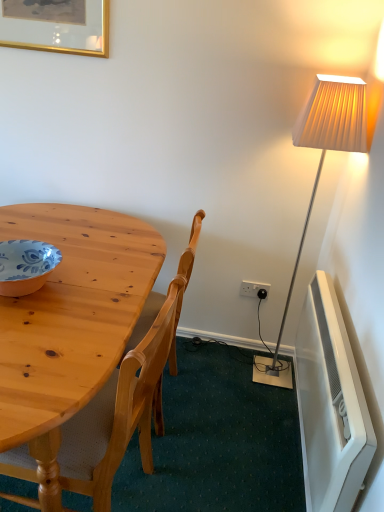
Question: Can you confirm if gold-framed picture at upper left is shorter than natural wood chair at left?

Choices:
 (A) yes
 (B) no

Answer: (A)

Question: Considering the relative positions of gold-framed picture at upper left and natural wood chair at left in the image provided, is gold-framed picture at upper left behind natural wood chair at left?

Choices:
 (A) no
 (B) yes

Answer: (B)

Question: Is natural wood chair at left completely or partially inside gold-framed picture at upper left?

Choices:
 (A) no
 (B) yes

Answer: (A)

Question: From a real-world perspective, is gold-framed picture at upper left located higher than natural wood chair at left?

Choices:
 (A) yes
 (B) no

Answer: (A)

Question: Is gold-framed picture at upper left smaller than natural wood chair at left?

Choices:
 (A) no
 (B) yes

Answer: (B)

Question: Which is correct: matte orange bowl at left is inside gold-framed picture at upper left, or outside of it?

Choices:
 (A) outside
 (B) inside

Answer: (A)

Question: Considering the positions of matte orange bowl at left and gold-framed picture at upper left in the image, is matte orange bowl at left wider or thinner than gold-framed picture at upper left?

Choices:
 (A) wide
 (B) thin

Answer: (A)

Question: From the image's perspective, is matte orange bowl at left located above or below gold-framed picture at upper left?

Choices:
 (A) below
 (B) above

Answer: (A)

Question: Does point click(6, 292) appear closer or farther from the camera than point click(97, 28)?

Choices:
 (A) farther
 (B) closer

Answer: (B)

Question: Is gold-framed picture at upper left taller or shorter than natural wood chair at left?

Choices:
 (A) tall
 (B) short

Answer: (B)

Question: From the image's perspective, is gold-framed picture at upper left located above or below natural wood chair at left?

Choices:
 (A) above
 (B) below

Answer: (A)

Question: From a real-world perspective, is gold-framed picture at upper left physically located above or below natural wood chair at left?

Choices:
 (A) below
 (B) above

Answer: (B)

Question: Is gold-framed picture at upper left inside or outside of natural wood chair at left?

Choices:
 (A) outside
 (B) inside

Answer: (A)

Question: Is white plastic power outlet at lower right situated inside white plastic radiator at lower right or outside?

Choices:
 (A) inside
 (B) outside

Answer: (B)

Question: From their relative heights in the image, would you say white plastic power outlet at lower right is taller or shorter than white plastic radiator at lower right?

Choices:
 (A) short
 (B) tall

Answer: (A)